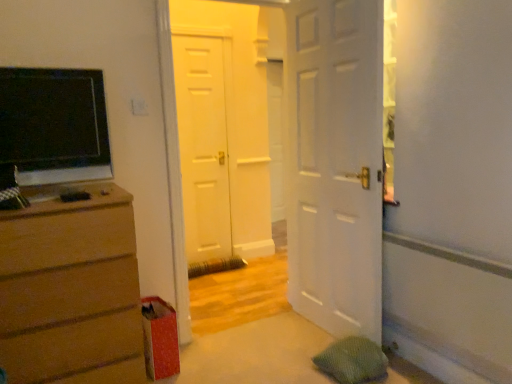
Find the location of a particular element. The image size is (512, 384). free region under white matte door at center, the third door viewed from the back (from a real-world perspective) is located at coordinates (314, 327).